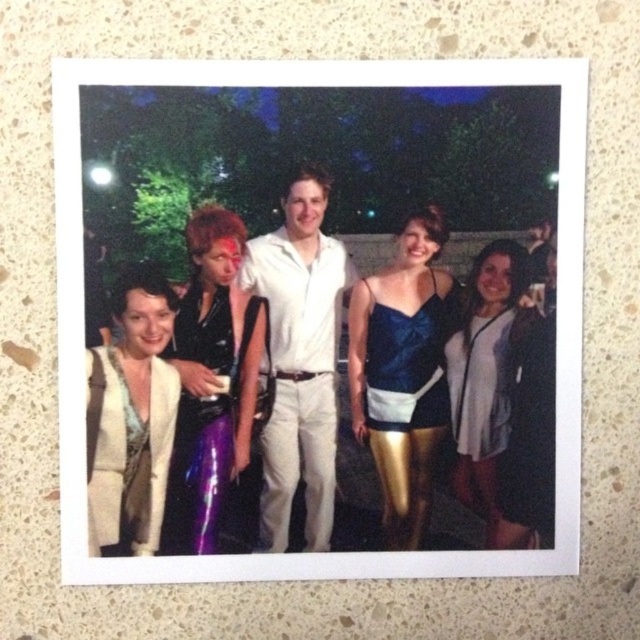
Question: Which point is closer to the camera?

Choices:
 (A) (378, 312)
 (B) (278, 406)

Answer: (B)

Question: Is white fuzzy coat at left below matte white shirt at center?

Choices:
 (A) no
 (B) yes

Answer: (B)

Question: Is white fuzzy coat at left thinner than white matte shirt at center?

Choices:
 (A) yes
 (B) no

Answer: (B)

Question: Which object is closer to the camera taking this photo?

Choices:
 (A) white matte jacket at right
 (B) shiny purple dress at center
 (C) blue satin dress at center

Answer: (B)

Question: Among these points, which one is farthest from the camera?

Choices:
 (A) (456, 444)
 (B) (147, 512)
 (C) (444, 374)
 (D) (492, 342)

Answer: (C)

Question: In this image, where is white cotton shirt at center located relative to white fuzzy coat at left?

Choices:
 (A) above
 (B) below

Answer: (A)